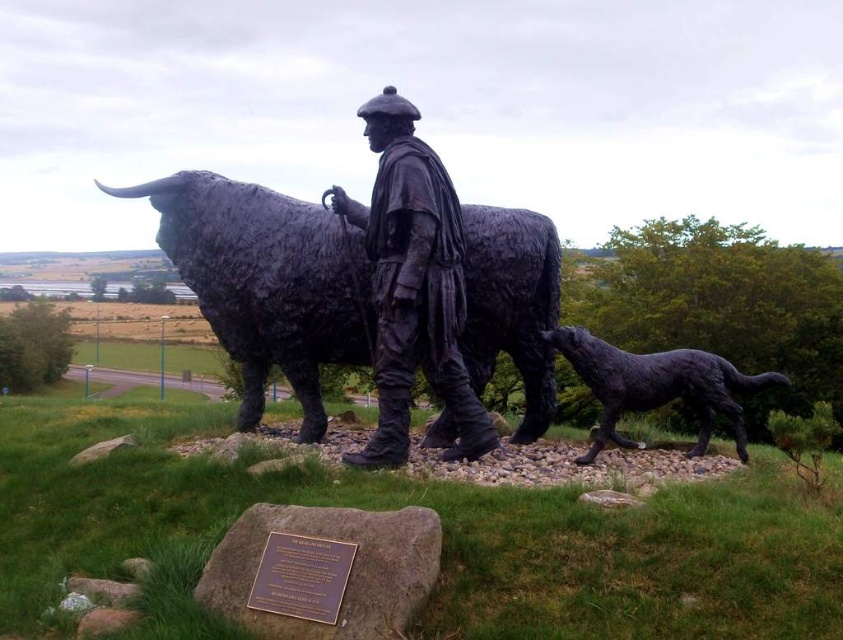
You are an art student analyzing the sculpture. You notice the black polished stone bull at center and the bronze statue of man at center. Which one is shorter in height?

The black polished stone bull at center has a lesser height compared to bronze statue of man at center, so the black polished stone bull at center is shorter.

You are a photographer planning to take a picture of the bronze statue of man at center and the shiny black dog at lower right. Since you want to emphasize the size difference between them, which one should you focus on to highlight the contrast?

The bronze statue of man at center is larger than the shiny black dog at lower right, so focusing on the bronze statue of man at center will emphasize the size contrast between them.